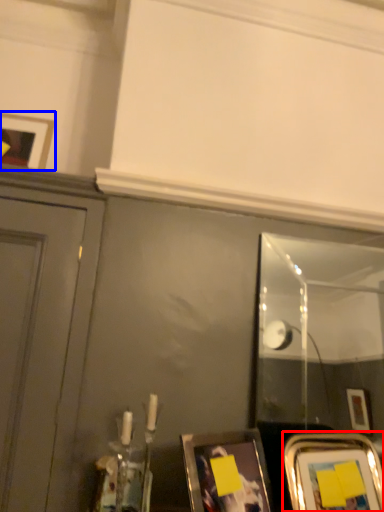
Question: Among these objects, which one is farthest to the camera, picture frame (highlighted by a red box) or picture frame (highlighted by a blue box)?

Choices:
 (A) picture frame
 (B) picture frame

Answer: (B)